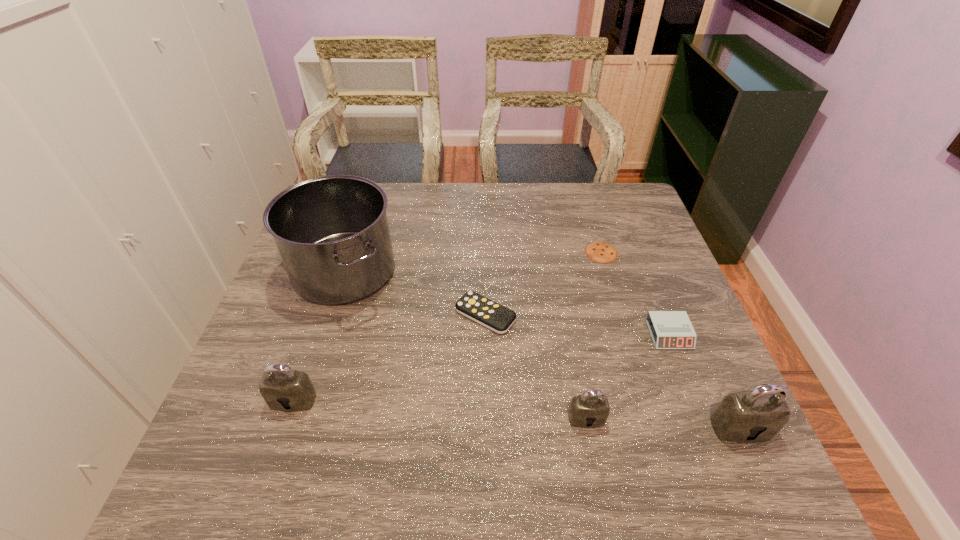
At what (x,y) coordinates should I click in order to perform the action: click on saucepan. Please return your answer as a coordinate pair (x, y). Looking at the image, I should click on (332, 233).

Where is `alarm clock`? alarm clock is located at coordinates (669, 329).

Identify the location of free space located at the front of the second tallest padlock near the keyhole. (281, 436).

This screenshot has width=960, height=540. Find the location of `free space located on the left of the remote control`. free space located on the left of the remote control is located at coordinates (382, 315).

Identify the location of vacant space located on the back of the shortest object. This screenshot has width=960, height=540. (588, 210).

You are a GUI agent. You are given a task and a screenshot of the screen. Output one action in this format:
    pyautogui.click(x=<x>, y=<y>)
    Task: Click on the free space located on the back of the tallest object
    This screenshot has height=540, width=960.
    Given the screenshot: What is the action you would take?
    pyautogui.click(x=373, y=184)

What are the coordinates of `vacant space situated 0.080m on the front of the alarm clock` in the screenshot? It's located at (686, 380).

You are a GUI agent. You are given a task and a screenshot of the screen. Output one action in this format:
    pyautogui.click(x=<x>, y=<y>)
    Task: Click on the padlock located in the left edge section of the desktop
    Image resolution: width=960 pixels, height=540 pixels.
    Given the screenshot: What is the action you would take?
    pyautogui.click(x=283, y=389)

Identify the location of saucepan situated at the left edge. The width and height of the screenshot is (960, 540). (332, 233).

Locate an element on the screen. The image size is (960, 540). padlock present at the right edge is located at coordinates (757, 415).